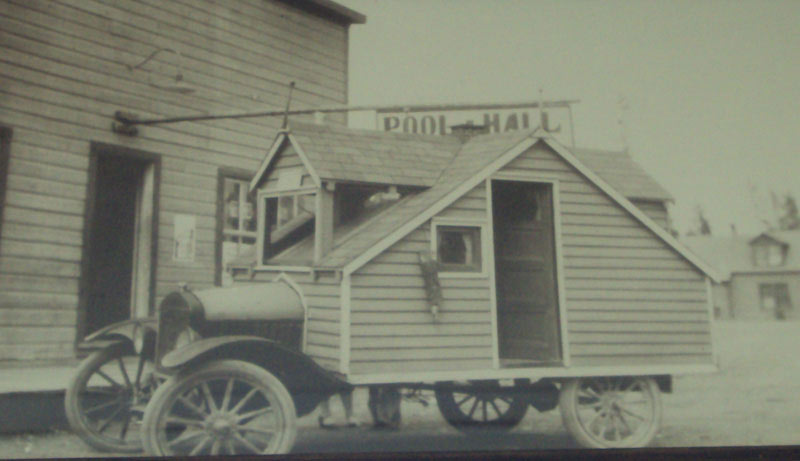
You are a GUI agent. You are given a task and a screenshot of the screen. Output one action in this format:
    pyautogui.click(x=<x>, y=<y>)
    Task: Click on the industrial light fixture above doorway
    The height and width of the screenshot is (461, 800).
    Given the screenshot: What is the action you would take?
    pyautogui.click(x=172, y=77)